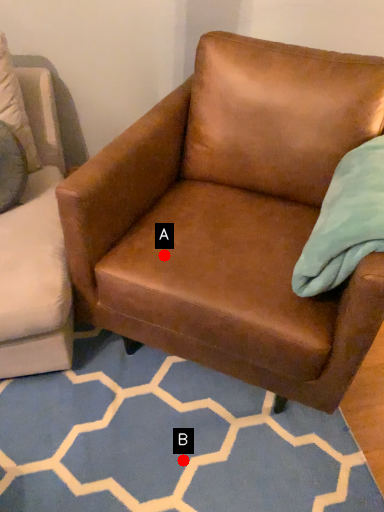
Question: Two points are circled on the image, labeled by A and B beside each circle. Which point is closer to the camera taking this photo?

Choices:
 (A) A is closer
 (B) B is closer

Answer: (A)